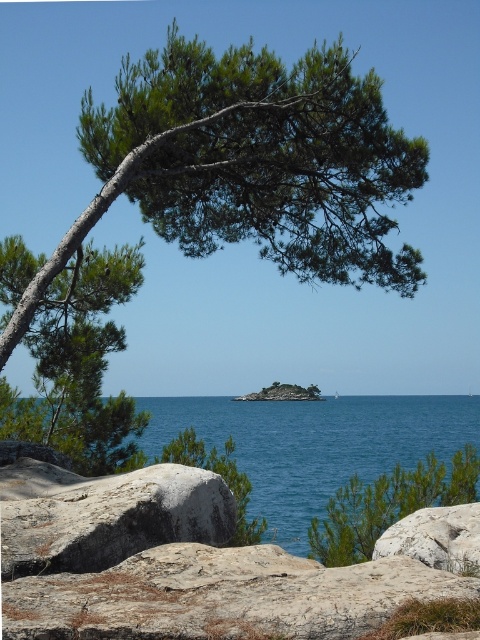
Where is `green needle-like leaves at upper left`? green needle-like leaves at upper left is located at coordinates pos(227,179).

You are a GUI agent. You are given a task and a screenshot of the screen. Output one action in this format:
    pyautogui.click(x=<x>, y=<y>)
    Task: Click on the green needle-like leaves at upper left
    The height and width of the screenshot is (640, 480).
    Given the screenshot: What is the action you would take?
    pyautogui.click(x=227, y=179)

Is smooth gray rock at center closer to camera compared to gray rough boulder at lower left?

Yes.

Is smooth gray rock at center smaller than gray rough boulder at lower left?

No.

Find the location of a particular element. This screenshot has width=480, height=640. smooth gray rock at center is located at coordinates (176, 564).

Is blue water at center thinner than gray rough boulder at lower left?

No, blue water at center is not thinner than gray rough boulder at lower left.

Can you confirm if blue water at center is positioned to the right of gray rough boulder at lower left?

Yes, blue water at center is to the right of gray rough boulder at lower left.

Find the location of a particular element. blue water at center is located at coordinates (315, 444).

Locate an element on the screen. This screenshot has width=480, height=640. blue water at center is located at coordinates (315, 444).